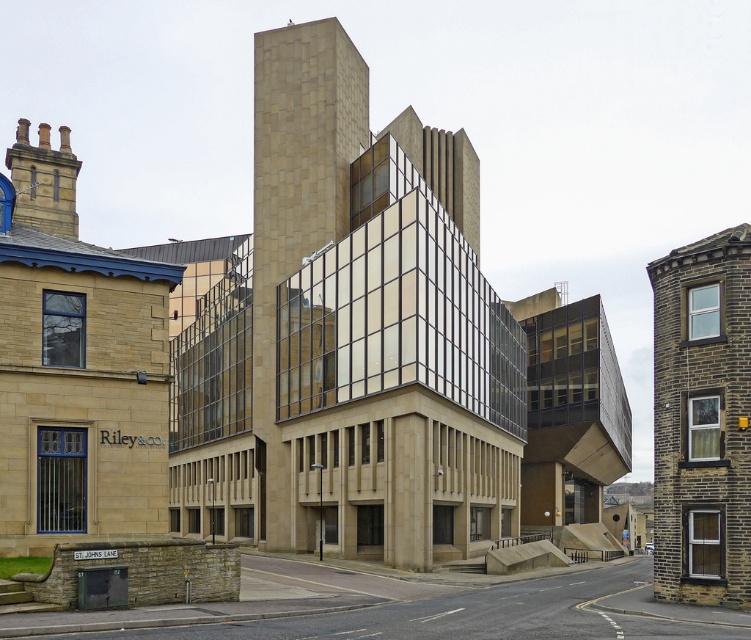
You are an architect analyzing the structural integrity of the beige stone tower at center and the brown stone tower at right. Based on their positions, which tower is more likely to require additional support due to its placement?

The beige stone tower at center is positioned over the brown stone tower at right, so the beige stone tower at center is more likely to require additional support due to its placement over the other structure.

You are standing in front of the modern architectural structure described in the scene. There is a point labeled at coordinates point (348, 337). Based on the scene description, can you determine which part of the building this point is located on?

The point (348, 337) is located on the beige stone tower at center.

You are an urban planner assessing the impact of two towers on the city skyline. The beige stone tower at center and the brown stone tower at right are both visible from the main boulevard. Which tower would appear more dominant in the skyline view?

The beige stone tower at center is larger in size than the brown stone tower at right, making it more dominant in the skyline view.